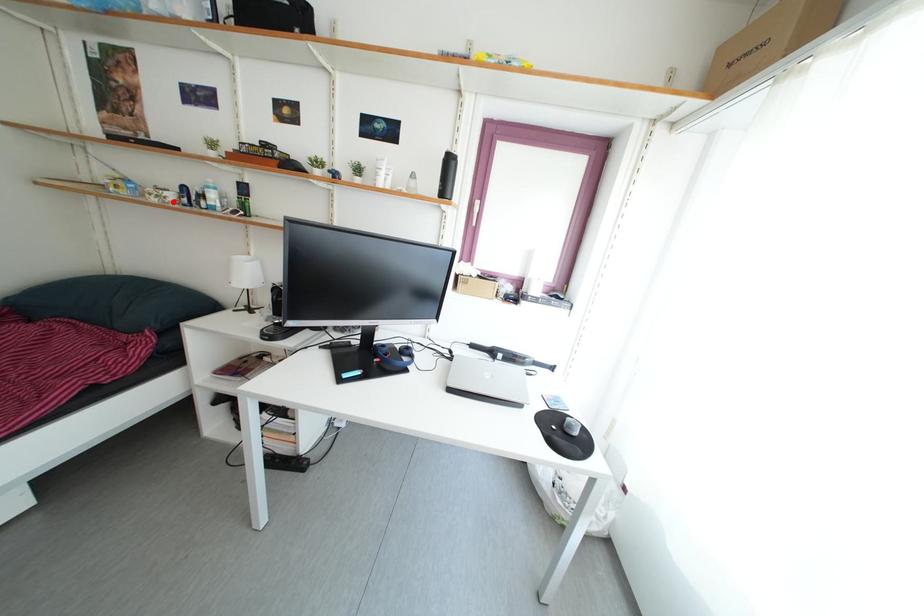
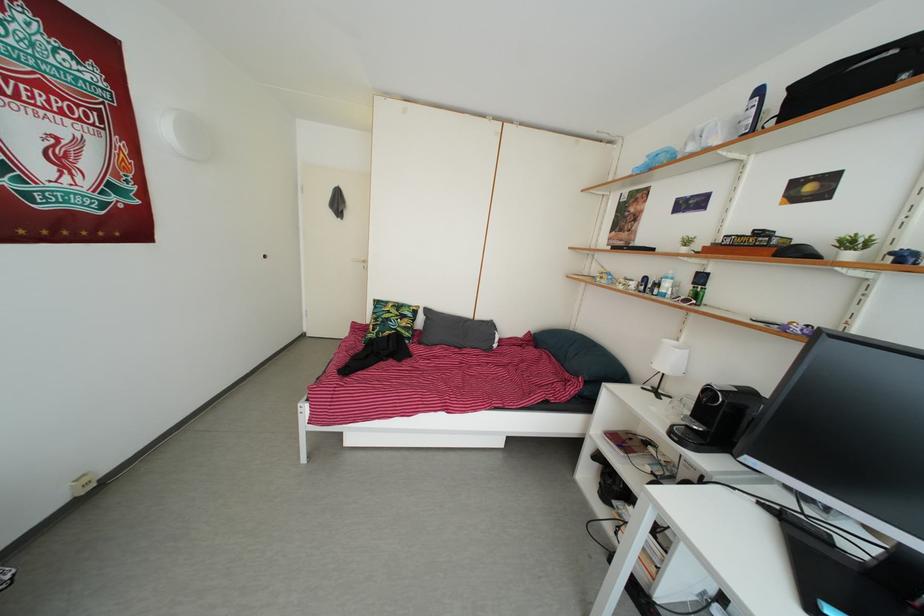
Locate, in the second image, the point that corresponds to the highlighted location in the first image.

(638, 291)